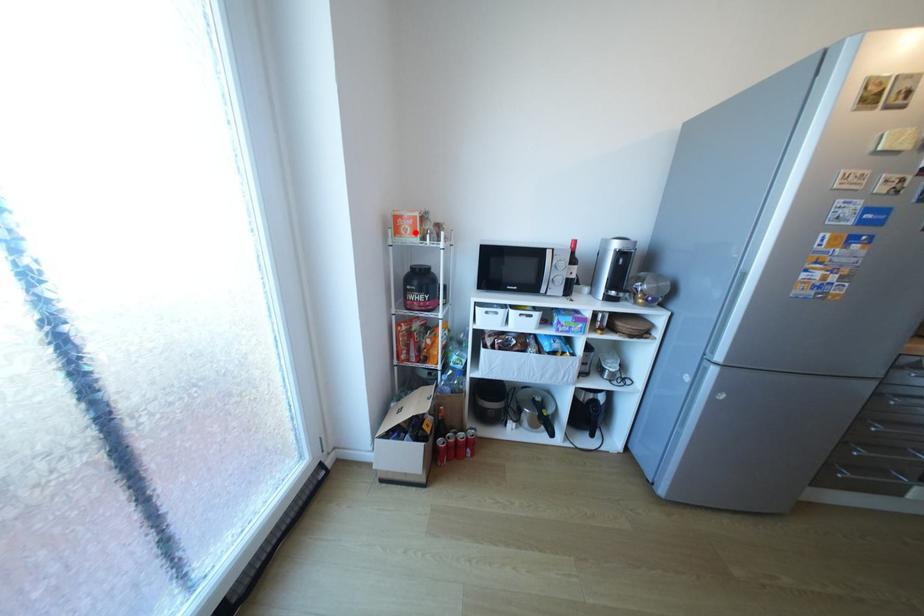
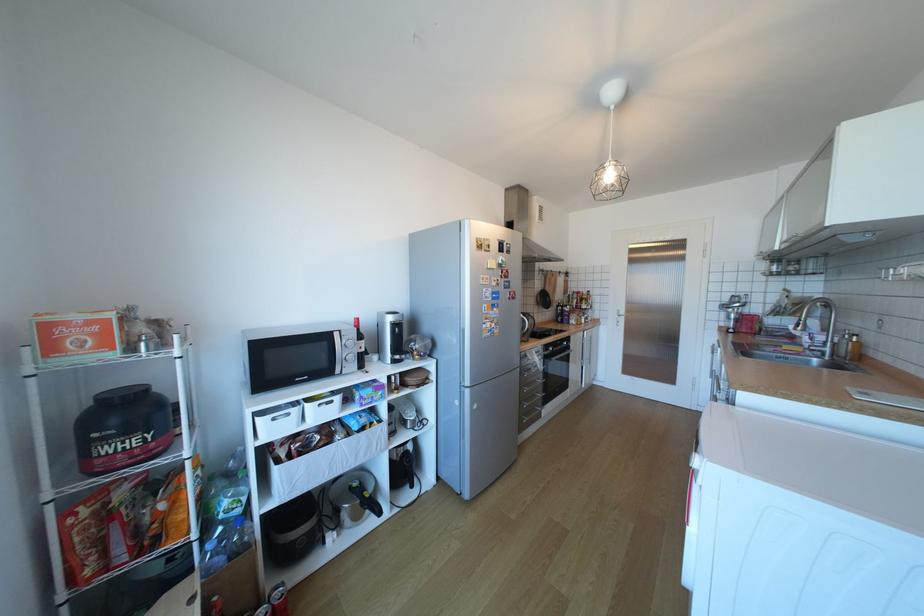
In the second image, find the point that corresponds to the highlighted location in the first image.

(91, 346)